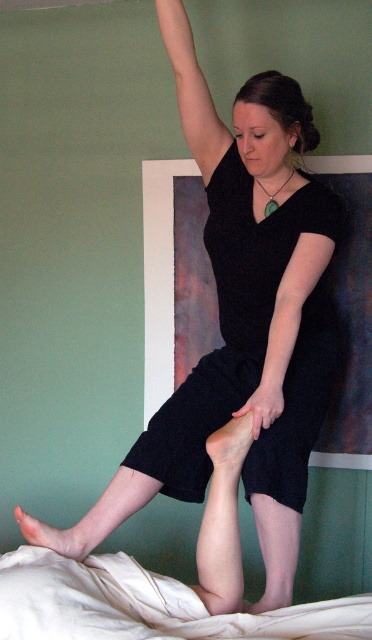
You are a physical therapist observing the session. You need to ensure that the black matte arm at center and the matte white foot at lower center do not touch each other to avoid discomfort. Based on their sizes, which one requires more space horizontally to maintain this distance?

The black matte arm at center requires more space horizontally because its width is larger than the matte white foot at lower center.

You are a physical therapist observing the scene. You notice the black textured dress at center and the matte white foot at lower center. Which object takes up more space in the image?

The black textured dress at center has a larger size compared to the matte white foot at lower center, so it takes up more space in the image.